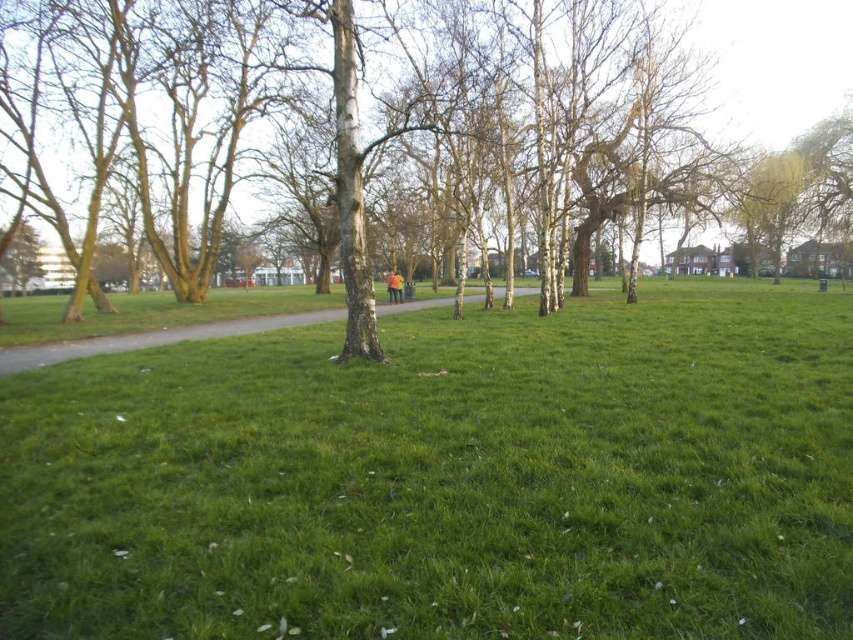
Question: Which object is closer to the camera taking this photo?

Choices:
 (A) gravel path at center
 (B) green bark tree at center

Answer: (A)

Question: Which object is positioned farthest from the green bark tree at center?

Choices:
 (A) gravel path at center
 (B) green grassy at center

Answer: (B)

Question: Does green grassy at center have a larger size compared to gravel path at center?

Choices:
 (A) no
 (B) yes

Answer: (A)

Question: From the image, what is the correct spatial relationship of green bark tree at center in relation to gravel path at center?

Choices:
 (A) right
 (B) left

Answer: (A)

Question: Which point is farther from the camera taking this photo?

Choices:
 (A) pyautogui.click(x=271, y=317)
 (B) pyautogui.click(x=733, y=92)

Answer: (B)

Question: Does green grassy at center appear on the right side of gravel path at center?

Choices:
 (A) no
 (B) yes

Answer: (B)